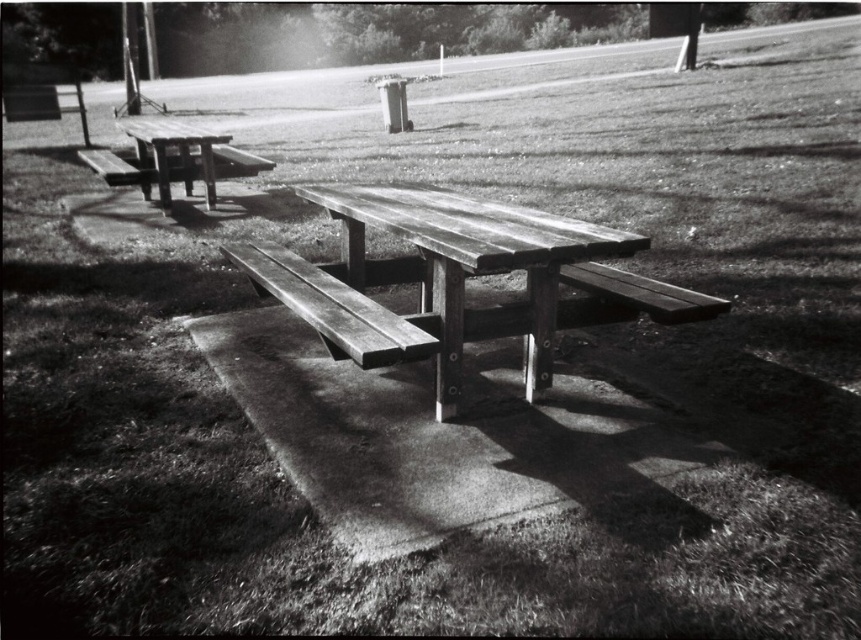
Question: Where is wooden picnic table at center located in relation to wooden picnic table at left in the image?

Choices:
 (A) above
 (B) below

Answer: (B)

Question: Does wooden bench at center appear over wooden picnic table at left?

Choices:
 (A) yes
 (B) no

Answer: (B)

Question: Based on their relative distances, which object is farther from the wooden picnic table at center?

Choices:
 (A) wooden picnic table at left
 (B) wooden bench at center

Answer: (A)

Question: Which point appears farthest from the camera in this image?

Choices:
 (A) (318, 304)
 (B) (525, 304)

Answer: (B)

Question: Which object is positioned closest to the wooden picnic table at left?

Choices:
 (A) wooden bench at center
 (B) wooden picnic table at center

Answer: (A)

Question: Does wooden bench at center appear over wooden picnic table at left?

Choices:
 (A) yes
 (B) no

Answer: (B)